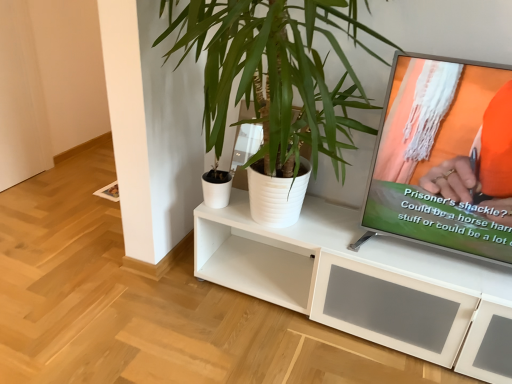
Measure the distance between matte silver tv at right and camera.

They are 4.42 feet apart.

Locate an element on the screen. matte silver tv at right is located at coordinates (446, 156).

Describe the element at coordinates (446, 156) in the screenshot. I see `matte silver tv at right` at that location.

Find the location of a particular element. The image size is (512, 384). matte silver tv at right is located at coordinates (446, 156).